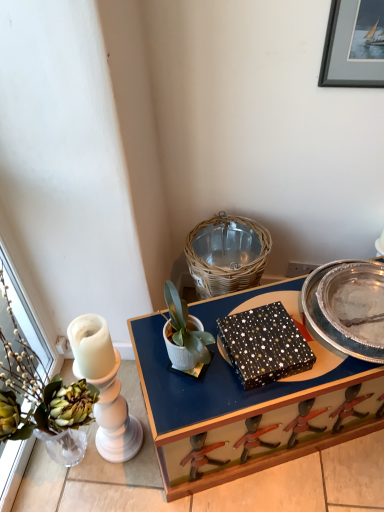
I want to click on empty space that is in between black textured box at center and silver metallic tray at center-right, so click(309, 344).